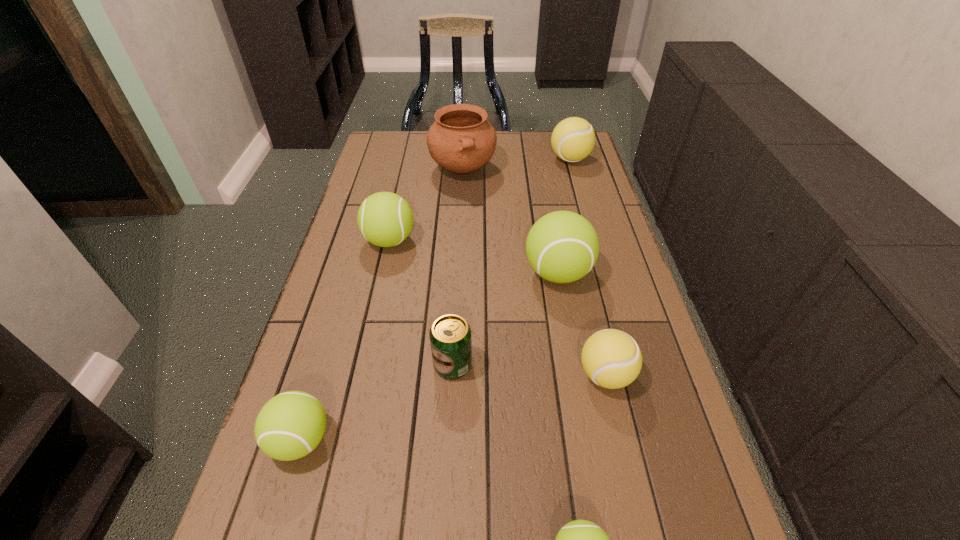
Where is `free region located 0.200m on the left of the pottery`? free region located 0.200m on the left of the pottery is located at coordinates (372, 170).

Where is `vacant space situated on the left of the tallest tennis ball`? The width and height of the screenshot is (960, 540). vacant space situated on the left of the tallest tennis ball is located at coordinates (406, 273).

Locate an element on the screen. The image size is (960, 540). vacant space located 0.360m on the front of the second biggest green tennis ball is located at coordinates (360, 371).

Find the location of `vacant area situated on the left of the farthest tennis ball`. vacant area situated on the left of the farthest tennis ball is located at coordinates (490, 159).

Locate an element on the screen. free spot located on the right of the green beer can is located at coordinates (582, 364).

You are a GUI agent. You are given a task and a screenshot of the screen. Output one action in this format:
    pyautogui.click(x=<x>, y=<y>)
    Task: Click on the vacant area situated 0.170m on the front of the third nearest tennis ball
    The height and width of the screenshot is (540, 960).
    Given the screenshot: What is the action you would take?
    pyautogui.click(x=632, y=487)

The height and width of the screenshot is (540, 960). Find the location of `vacant position located on the back of the second smallest green tennis ball`. vacant position located on the back of the second smallest green tennis ball is located at coordinates (348, 280).

This screenshot has width=960, height=540. In order to click on pottery that is at the far edge in this screenshot , I will do `click(461, 140)`.

Locate an element on the screen. tennis ball positioned at the far edge is located at coordinates (573, 139).

The height and width of the screenshot is (540, 960). Identify the location of object that is at the far right corner. (573, 139).